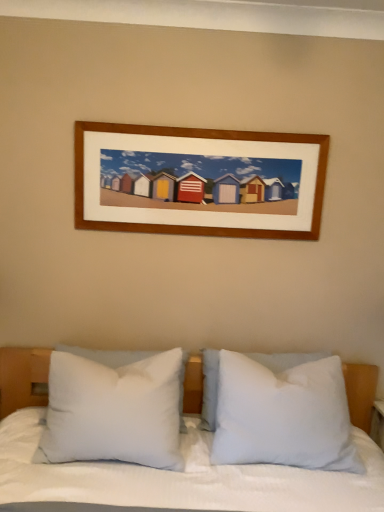
Question: In which direction should I rotate to look at white soft pillow at center, the 1th pillow in the right-to-left sequence?

Choices:
 (A) right
 (B) left

Answer: (A)

Question: From the image's perspective, is white soft pillow at center, the third pillow positioned from the right, below white soft pillow at center, the 1th pillow in the right-to-left sequence?

Choices:
 (A) yes
 (B) no

Answer: (B)

Question: Can you confirm if white soft pillow at center, the third pillow positioned from the right, is positioned to the right of white soft pillow at center, the 1th pillow in the right-to-left sequence?

Choices:
 (A) yes
 (B) no

Answer: (B)

Question: Is white soft pillow at center, the 1th pillow when ordered from left to right, facing away from white soft pillow at center, the 1th pillow in the right-to-left sequence?

Choices:
 (A) yes
 (B) no

Answer: (B)

Question: Is white soft pillow at center, the third pillow positioned from the right, bigger than white soft pillow at center, arranged as the 3th pillow when viewed from the left?

Choices:
 (A) no
 (B) yes

Answer: (A)

Question: Does white soft pillow at center, the third pillow positioned from the right, come behind white soft pillow at center, arranged as the 3th pillow when viewed from the left?

Choices:
 (A) yes
 (B) no

Answer: (B)

Question: Does white soft pillow at center, the third pillow positioned from the right, lie in front of white soft pillow at center, the 1th pillow in the right-to-left sequence?

Choices:
 (A) yes
 (B) no

Answer: (A)

Question: From a real-world perspective, does white soft pillow at center, the 1th pillow in the right-to-left sequence, stand above white soft pillow at center, arranged as the 2th pillow when viewed from the left?

Choices:
 (A) yes
 (B) no

Answer: (A)

Question: Is white soft pillow at center, the 2th pillow positioned from the right, completely or partially inside white soft pillow at center, arranged as the 3th pillow when viewed from the left?

Choices:
 (A) yes
 (B) no

Answer: (A)

Question: Considering the relative sizes of white soft pillow at center, arranged as the 3th pillow when viewed from the left, and white soft pillow at center, arranged as the 2th pillow when viewed from the left, in the image provided, is white soft pillow at center, arranged as the 3th pillow when viewed from the left, taller than white soft pillow at center, arranged as the 2th pillow when viewed from the left,?

Choices:
 (A) yes
 (B) no

Answer: (A)

Question: Considering the relative sizes of white soft pillow at center, arranged as the 3th pillow when viewed from the left, and white soft pillow at center, the 2th pillow positioned from the right, in the image provided, is white soft pillow at center, arranged as the 3th pillow when viewed from the left, smaller than white soft pillow at center, the 2th pillow positioned from the right,?

Choices:
 (A) no
 (B) yes

Answer: (A)

Question: Is there a large distance between white soft pillow at center, the 1th pillow in the right-to-left sequence, and white soft pillow at center, the 2th pillow positioned from the right?

Choices:
 (A) yes
 (B) no

Answer: (B)

Question: Can you confirm if white soft pillow at center, arranged as the 3th pillow when viewed from the left, is wider than white soft pillow at center, the 2th pillow positioned from the right?

Choices:
 (A) no
 (B) yes

Answer: (B)

Question: Considering the relative positions of white soft pillow at center, the 2th pillow positioned from the right, and white soft pillow at center, the third pillow positioned from the right, in the image provided, is white soft pillow at center, the 2th pillow positioned from the right, to the right of white soft pillow at center, the third pillow positioned from the right, from the viewer's perspective?

Choices:
 (A) no
 (B) yes

Answer: (B)